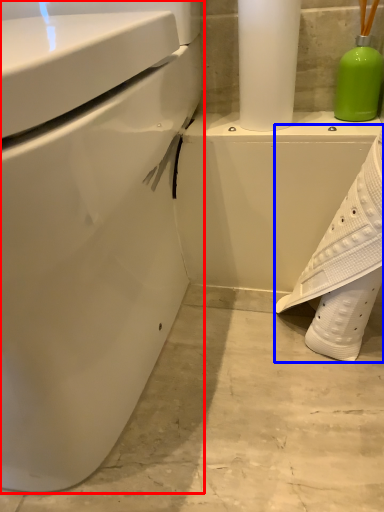
Question: Which object appears farthest to the camera in this image, toilet (highlighted by a red box) or shoe (highlighted by a blue box)?

Choices:
 (A) toilet
 (B) shoe

Answer: (B)